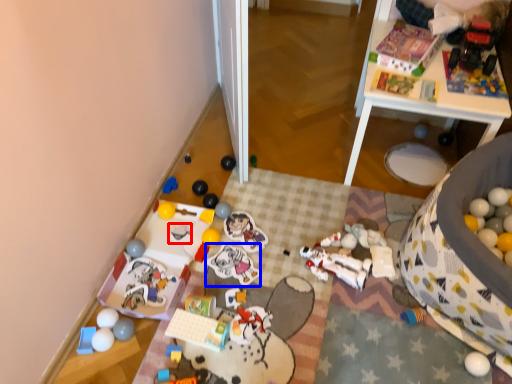
Question: Among these objects, which one is nearest to the camera, toy (highlighted by a red box) or toy (highlighted by a blue box)?

Choices:
 (A) toy
 (B) toy

Answer: (B)